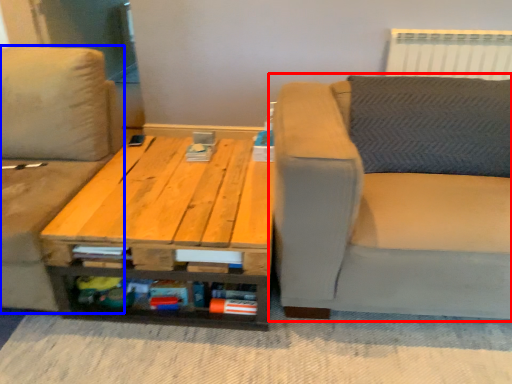
Question: Which point is closer to the camera, studio couch (highlighted by a red box) or studio couch (highlighted by a blue box)?

Choices:
 (A) studio couch
 (B) studio couch

Answer: (A)